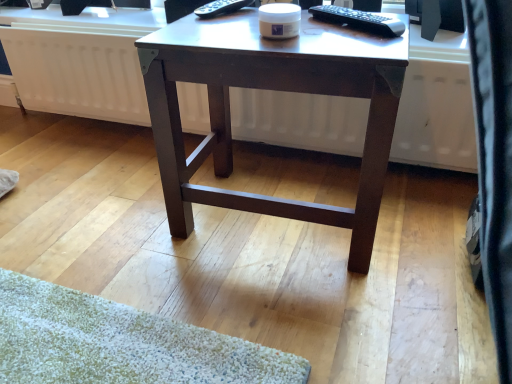
Question: From the image's perspective, is black plastic remote control at upper center, marked as the 1th remote control in a left-to-right arrangement, under black glossy monitor at upper right?

Choices:
 (A) no
 (B) yes

Answer: (B)

Question: From the image's perspective, is black plastic remote control at upper center, the 2th remote control from the right, on top of black glossy monitor at upper right?

Choices:
 (A) no
 (B) yes

Answer: (A)

Question: Does black plastic remote control at upper center, the 1th remote control positioned from the back, have a greater height compared to black glossy monitor at upper right?

Choices:
 (A) yes
 (B) no

Answer: (B)

Question: Is the depth of black plastic remote control at upper center, which is the second remote control in front-to-back order, greater than that of black glossy monitor at upper right?

Choices:
 (A) yes
 (B) no

Answer: (B)

Question: Is black plastic remote control at upper center, the 1th remote control positioned from the back, bigger than black glossy monitor at upper right?

Choices:
 (A) yes
 (B) no

Answer: (B)

Question: From a real-world perspective, is black plastic remote control at upper center, the 1th remote control positioned from the back, positioned over black glossy monitor at upper right based on gravity?

Choices:
 (A) yes
 (B) no

Answer: (A)

Question: From the image's perspective, would you say black plastic remote control at upper center, the 2th remote control from the right, is shown under black plastic remote control at upper right, the second remote control when ordered from back to front?

Choices:
 (A) yes
 (B) no

Answer: (B)

Question: Considering the relative sizes of black plastic remote control at upper center, the 2th remote control from the right, and black plastic remote control at upper right, the second remote control when ordered from back to front, in the image provided, is black plastic remote control at upper center, the 2th remote control from the right, wider than black plastic remote control at upper right, the second remote control when ordered from back to front,?

Choices:
 (A) yes
 (B) no

Answer: (A)

Question: Does black plastic remote control at upper center, the 2th remote control from the right, touch black plastic remote control at upper right, positioned as the 1th remote control in front-to-back order?

Choices:
 (A) yes
 (B) no

Answer: (B)

Question: Considering the relative positions of black plastic remote control at upper center, the 2th remote control from the right, and black plastic remote control at upper right, the second remote control in the left-to-right sequence, in the image provided, is black plastic remote control at upper center, the 2th remote control from the right, to the left of black plastic remote control at upper right, the second remote control in the left-to-right sequence, from the viewer's perspective?

Choices:
 (A) no
 (B) yes

Answer: (B)

Question: Is black plastic remote control at upper center, the 1th remote control positioned from the back, positioned far away from black plastic remote control at upper right, the second remote control when ordered from back to front?

Choices:
 (A) no
 (B) yes

Answer: (A)

Question: From the image's perspective, is black plastic remote control at upper center, marked as the 1th remote control in a left-to-right arrangement, over black plastic remote control at upper right, the second remote control when ordered from back to front?

Choices:
 (A) no
 (B) yes

Answer: (B)

Question: Is black glossy monitor at upper right positioned far away from white matte radiator at center?

Choices:
 (A) yes
 (B) no

Answer: (B)